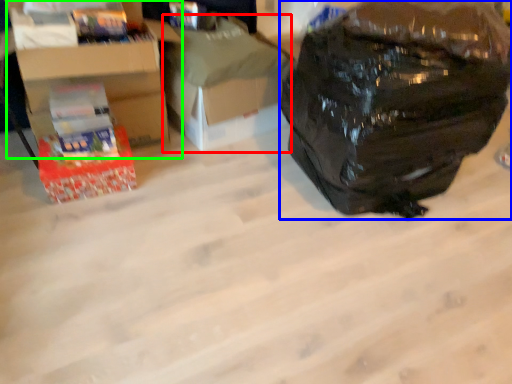
Question: Which object is positioned farthest from cardboard box (highlighted by a red box)? Select from backpack (highlighted by a blue box) and cardboard box (highlighted by a green box).

Choices:
 (A) backpack
 (B) cardboard box

Answer: (A)